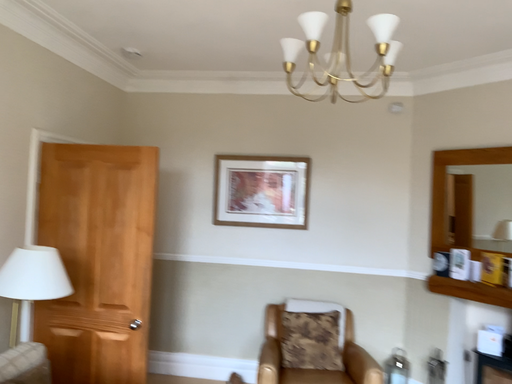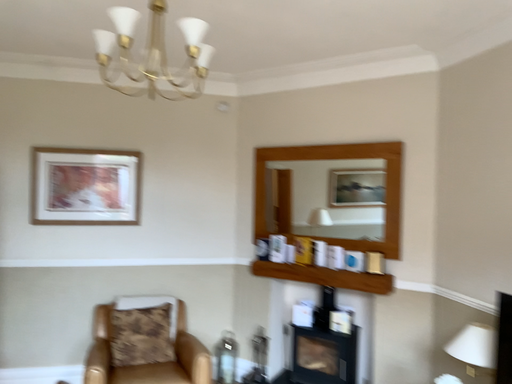
Question: Which way did the camera rotate in the video?

Choices:
 (A) rotated left
 (B) rotated right

Answer: (B)